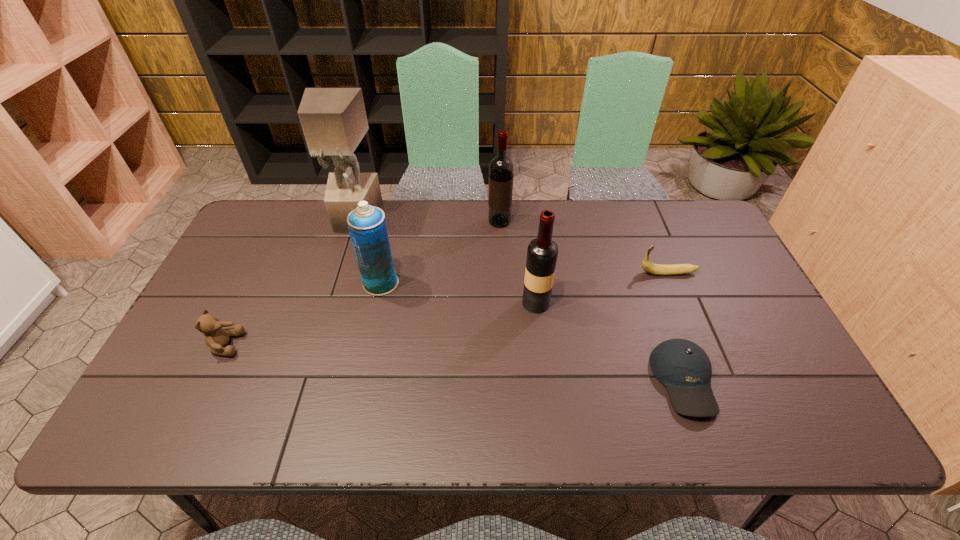
This screenshot has height=540, width=960. I want to click on free point that satisfies the following two spatial constraints: 1. at the stem of the banana; 2. on the front-facing side of the baseball cap, so click(712, 381).

I want to click on free space that satisfies the following two spatial constraints: 1. on the front-facing side of the sculpture; 2. on the left side of the right wine bottle, so click(329, 303).

Locate an element on the screen. Image resolution: width=960 pixels, height=540 pixels. vacant space that satisfies the following two spatial constraints: 1. on the front side of the fourth object from right to left; 2. on the right side of the right wine bottle is located at coordinates (503, 303).

Image resolution: width=960 pixels, height=540 pixels. What are the coordinates of `free space that satisfies the following two spatial constraints: 1. at the stem of the banana; 2. on the front-facing side of the shortest object` in the screenshot? It's located at (712, 381).